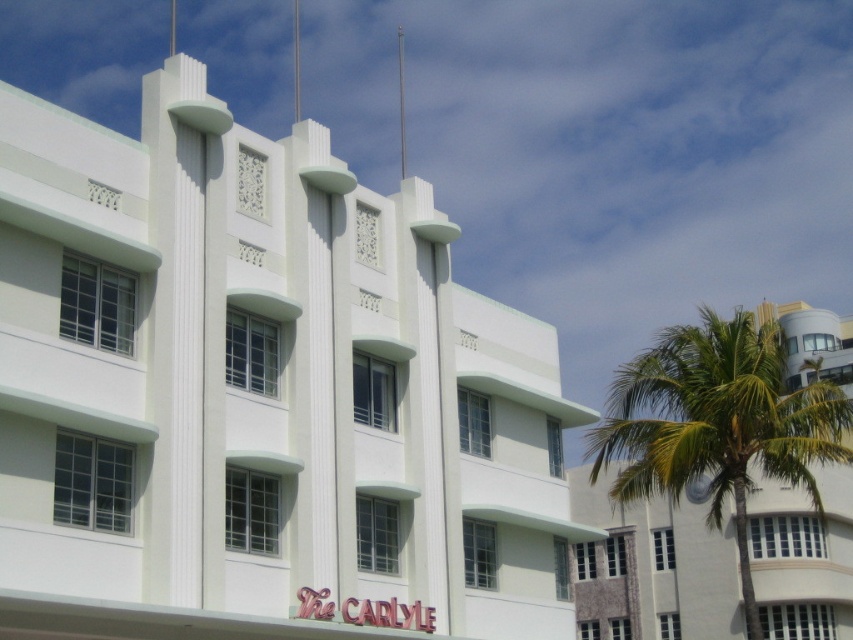
You are a photographer planning to capture the white smooth building at center and the green leafy palm tree at right in one frame. Based on their widths, which object should you position closer to the center of your camera frame to ensure both fit well?

The white smooth building at center has a lesser width compared to the green leafy palm tree at right. To ensure both fit well in the frame, position the white smooth building at center closer to the center of the camera frame since it is narrower and requires less space.

You are standing in front of The Carlyle building. If you want to take a photo of the white smooth building at center, where should you position yourself relative to the building?

The white smooth building at center is located at point (258, 392), so you should position yourself directly in front of the building at that coordinate to capture it in the center of your photo.

You are standing in front of The Carlyle building and want to take a photo that includes both the white smooth building at center and the green leafy palm tree at right. Which object should you position closer to the camera to ensure both are in focus?

To ensure both the white smooth building at center and the green leafy palm tree at right are in focus, position the camera closer to the white smooth building at center since it is nearer to the viewer than the palm tree.